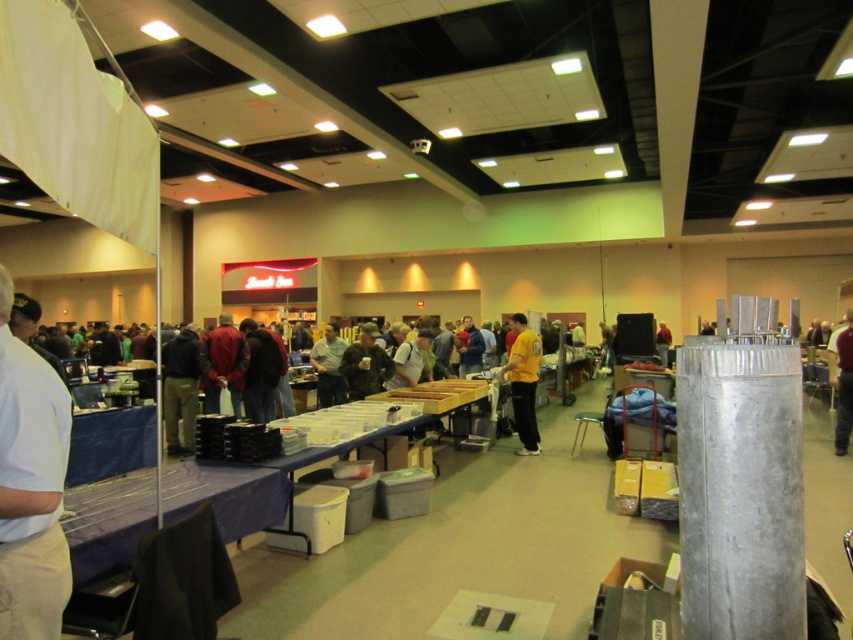
Is white cotton shirt at left to the right of yellow shirt at center from the viewer's perspective?

Incorrect, white cotton shirt at left is not on the right side of yellow shirt at center.

Is white cotton shirt at left bigger than yellow shirt at center?

Incorrect, white cotton shirt at left is not larger than yellow shirt at center.

Which is behind, point (41, 492) or point (843, 352)?

Positioned behind is point (843, 352).

You are a GUI agent. You are given a task and a screenshot of the screen. Output one action in this format:
    pyautogui.click(x=<x>, y=<y>)
    Task: Click on the white cotton shirt at left
    
    Given the screenshot: What is the action you would take?
    pyautogui.click(x=30, y=486)

Is white cotton shirt at left above yellow matte shirt at center?

Yes, white cotton shirt at left is above yellow matte shirt at center.

Can you confirm if white cotton shirt at left is smaller than yellow matte shirt at center?

Yes.

Describe the element at coordinates (30, 486) in the screenshot. I see `white cotton shirt at left` at that location.

The image size is (853, 640). In order to click on white cotton shirt at left in this screenshot , I will do `click(30, 486)`.

Who is positioned more to the left, yellow matte shirt at center or yellow shirt at center?

yellow matte shirt at center

How distant is yellow matte shirt at center from yellow shirt at center?

3.18 meters

Measure the distance between yellow matte shirt at center and camera.

The distance of yellow matte shirt at center from camera is 7.12 meters.

What are the coordinates of `yellow matte shirt at center` in the screenshot? It's located at (523, 381).